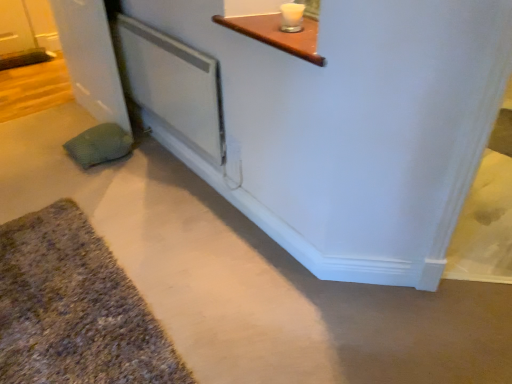
Looking at this image, in order to face white glossy door at left, should I rotate leftwards or rightwards?

A 22.239 degree turn to the left will do.

Locate an element on the screen. This screenshot has height=384, width=512. white glossy door at left is located at coordinates (91, 59).

Measure the distance between green textured pillow at lower left and camera.

A distance of 7.38 feet exists between green textured pillow at lower left and camera.

Locate an element on the screen. This screenshot has width=512, height=384. white plastic screen door at center is located at coordinates (173, 85).

Based on the photo, from a real-world perspective, relative to textured gray bath mat at lower left, is white glossy door at left vertically above or below?

white glossy door at left is above textured gray bath mat at lower left.

Where is `door on the left of textured gray bath mat at lower left`? This screenshot has width=512, height=384. door on the left of textured gray bath mat at lower left is located at coordinates (91, 59).

Is white glossy door at left taller or shorter than textured gray bath mat at lower left?

Considering their sizes, white glossy door at left has more height than textured gray bath mat at lower left.

Are white glossy door at left and textured gray bath mat at lower left far apart?

Absolutely, white glossy door at left is distant from textured gray bath mat at lower left.

Considering the points (100, 127) and (218, 91), which point is behind, point (100, 127) or point (218, 91)?

The point (100, 127) is farther from the camera.

Visually, is green textured pillow at lower left positioned to the left or to the right of white plastic screen door at center?

green textured pillow at lower left is to the left of white plastic screen door at center.

Relative to white plastic screen door at center, is green textured pillow at lower left in front or behind?

Visually, green textured pillow at lower left is located behind white plastic screen door at center.

Does green textured pillow at lower left have a lesser height compared to white plastic screen door at center?

Yes, green textured pillow at lower left is shorter than white plastic screen door at center.

From a real-world perspective, is textured gray bath mat at lower left below green textured pillow at lower left?

Indeed, from a real-world perspective, textured gray bath mat at lower left is positioned beneath green textured pillow at lower left.

Looking at this image, is textured gray bath mat at lower left taller than green textured pillow at lower left?

Incorrect, the height of textured gray bath mat at lower left is not larger of that of green textured pillow at lower left.

From the image's perspective, who appears lower, textured gray bath mat at lower left or green textured pillow at lower left?

textured gray bath mat at lower left.

Between textured gray bath mat at lower left and green textured pillow at lower left, which one has smaller size?

green textured pillow at lower left.

Considering the relative positions of textured gray bath mat at lower left and white glossy door at left in the image provided, is textured gray bath mat at lower left in front of white glossy door at left?

Yes, textured gray bath mat at lower left is in front of white glossy door at left.

From a real-world perspective, is textured gray bath mat at lower left located higher than white glossy door at left?

No, from a real-world perspective, textured gray bath mat at lower left is not over white glossy door at left

Which object is positioned more to the left, textured gray bath mat at lower left or white glossy door at left?

From the viewer's perspective, white glossy door at left appears more on the left side.

Between point (101, 354) and point (114, 91), which one is positioned behind?

The point (114, 91) is behind.

Is white glossy door at left facing towards green textured pillow at lower left?

Yes, white glossy door at left is turned towards green textured pillow at lower left.

Considering the sizes of objects white glossy door at left and green textured pillow at lower left in the image provided, who is bigger, white glossy door at left or green textured pillow at lower left?

white glossy door at left.

Which is correct: white glossy door at left is inside green textured pillow at lower left, or outside of it?

white glossy door at left is not enclosed by green textured pillow at lower left.

Consider the image. Is white plastic screen door at center at the left side of textured gray bath mat at lower left?

No, white plastic screen door at center is not to the left of textured gray bath mat at lower left.

Is white plastic screen door at center not inside textured gray bath mat at lower left?

Yes, white plastic screen door at center is outside of textured gray bath mat at lower left.

Does point (205, 77) appear closer or farther from the camera than point (105, 315)?

Point (205, 77) is farther from the camera than point (105, 315).

Consider the image. Does green textured pillow at lower left turn towards textured gray bath mat at lower left?

No, green textured pillow at lower left does not turn towards textured gray bath mat at lower left.

From a real-world perspective, who is located lower, green textured pillow at lower left or textured gray bath mat at lower left?

textured gray bath mat at lower left, from a real-world perspective.

The height and width of the screenshot is (384, 512). I want to click on bath mat that is below the green textured pillow at lower left (from the image's perspective), so click(x=74, y=308).

Consider the image. Choose the correct answer: Is green textured pillow at lower left inside textured gray bath mat at lower left or outside it?

green textured pillow at lower left lies outside textured gray bath mat at lower left.

I want to click on bath mat that appears in front of the white glossy door at left, so click(x=74, y=308).

Identify the location of pillow beneath the white plastic screen door at center (from a real-world perspective). (99, 145).

When comparing their distances from textured gray bath mat at lower left, does green textured pillow at lower left or white plastic screen door at center seem closer?

Based on the image, green textured pillow at lower left appears to be nearer to textured gray bath mat at lower left.

Which object lies further to the anchor point white plastic screen door at center, green textured pillow at lower left or white glossy door at left?

The object further to white plastic screen door at center is green textured pillow at lower left.

From the image, which object appears to be farther from green textured pillow at lower left, white glossy door at left or textured gray bath mat at lower left?

Based on the image, textured gray bath mat at lower left appears to be further to green textured pillow at lower left.

Which object lies nearer to the anchor point green textured pillow at lower left, white plastic screen door at center or textured gray bath mat at lower left?

Based on the image, white plastic screen door at center appears to be nearer to green textured pillow at lower left.

Considering their positions, is green textured pillow at lower left positioned further to white glossy door at left than white plastic screen door at center?

Among the two, white plastic screen door at center is located further to white glossy door at left.

Based on their spatial positions, is textured gray bath mat at lower left or green textured pillow at lower left closer to white glossy door at left?

green textured pillow at lower left.

Estimate the real-world distances between objects in this image. Which object is further from textured gray bath mat at lower left, white glossy door at left or green textured pillow at lower left?

Among the two, white glossy door at left is located further to textured gray bath mat at lower left.

Based on their spatial positions, is white glossy door at left or green textured pillow at lower left closer to white plastic screen door at center?

white glossy door at left is closer to white plastic screen door at center.

The height and width of the screenshot is (384, 512). In order to click on screen door between textured gray bath mat at lower left and green textured pillow at lower left along the z-axis in this screenshot , I will do `click(173, 85)`.

Locate an element on the screen. door located between textured gray bath mat at lower left and green textured pillow at lower left in the depth direction is located at coordinates (91, 59).

Locate an element on the screen. screen door that lies between white glossy door at left and textured gray bath mat at lower left from top to bottom is located at coordinates (173, 85).

You are a GUI agent. You are given a task and a screenshot of the screen. Output one action in this format:
    pyautogui.click(x=<x>, y=<y>)
    Task: Click on the pillow situated between white glossy door at left and white plastic screen door at center from left to right
    
    Given the screenshot: What is the action you would take?
    pyautogui.click(x=99, y=145)